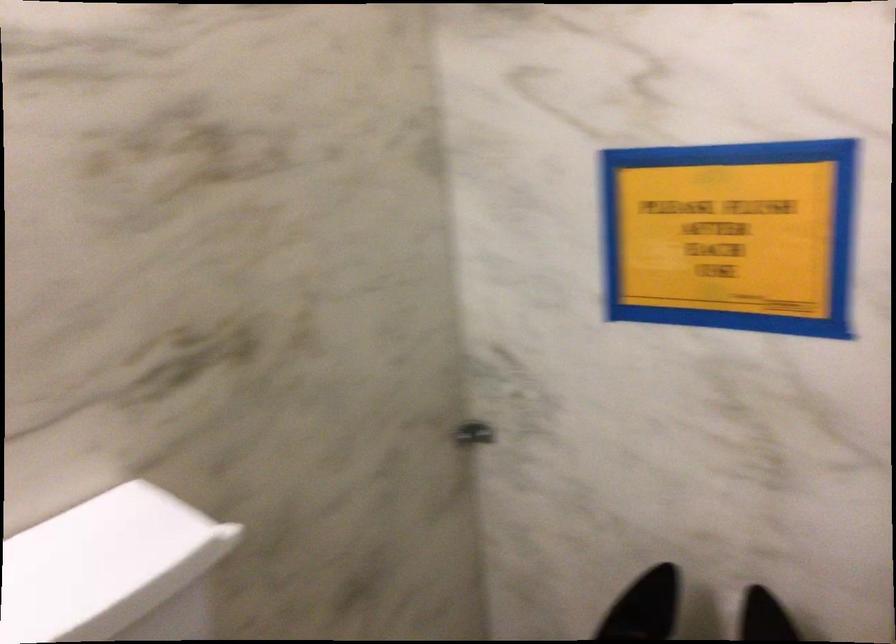
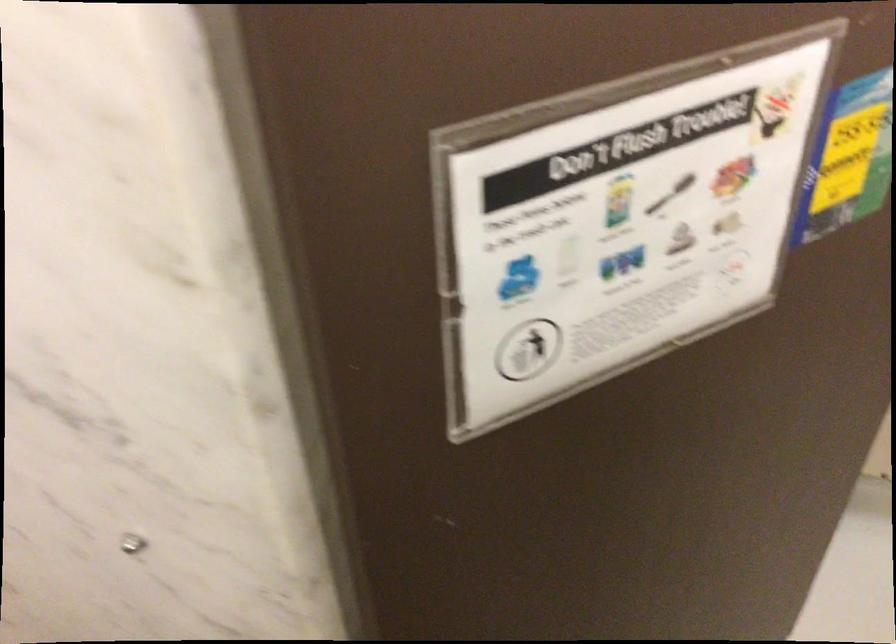
The first image is from the beginning of the video and the second image is from the end. How did the camera likely rotate when shooting the video?

The rotation direction of the camera is right-down.